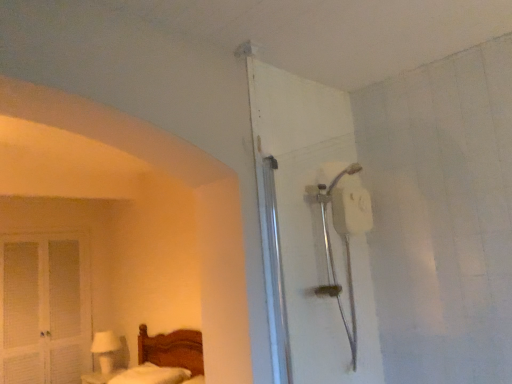
Question: From a real-world perspective, is white matte shower head at upper right positioned over white fluffy mattress at lower left based on gravity?

Choices:
 (A) no
 (B) yes

Answer: (B)

Question: Is white matte shower head at upper right positioned with its back to white fluffy mattress at lower left?

Choices:
 (A) yes
 (B) no

Answer: (B)

Question: From the image's perspective, is white matte shower head at upper right beneath white fluffy mattress at lower left?

Choices:
 (A) yes
 (B) no

Answer: (B)

Question: Is white matte shower head at upper right oriented towards white fluffy mattress at lower left?

Choices:
 (A) yes
 (B) no

Answer: (B)

Question: Can you confirm if white matte shower head at upper right is positioned to the left of white fluffy mattress at lower left?

Choices:
 (A) yes
 (B) no

Answer: (B)

Question: In terms of height, does white glossy table lamp at lower left look taller or shorter compared to white fluffy mattress at lower left?

Choices:
 (A) tall
 (B) short

Answer: (A)

Question: Based on their sizes in the image, would you say white glossy table lamp at lower left is bigger or smaller than white fluffy mattress at lower left?

Choices:
 (A) big
 (B) small

Answer: (B)

Question: Choose the correct answer: Is white glossy table lamp at lower left inside white fluffy mattress at lower left or outside it?

Choices:
 (A) outside
 (B) inside

Answer: (A)

Question: Is white glossy table lamp at lower left wider or thinner than white fluffy mattress at lower left?

Choices:
 (A) wide
 (B) thin

Answer: (B)

Question: Is white louvered screen door at left situated inside white matte shower head at upper right or outside?

Choices:
 (A) outside
 (B) inside

Answer: (A)

Question: Considering the positions of white louvered screen door at left and white matte shower head at upper right in the image, is white louvered screen door at left wider or thinner than white matte shower head at upper right?

Choices:
 (A) thin
 (B) wide

Answer: (A)

Question: Considering the positions of white louvered screen door at left and white matte shower head at upper right in the image, is white louvered screen door at left taller or shorter than white matte shower head at upper right?

Choices:
 (A) short
 (B) tall

Answer: (B)

Question: Is point (64, 342) positioned closer to the camera than point (272, 157)?

Choices:
 (A) farther
 (B) closer

Answer: (A)

Question: Would you say white louvered screen door at left is inside or outside white glossy table lamp at lower left?

Choices:
 (A) outside
 (B) inside

Answer: (A)

Question: From a real-world perspective, is white louvered screen door at left above or below white glossy table lamp at lower left?

Choices:
 (A) above
 (B) below

Answer: (A)